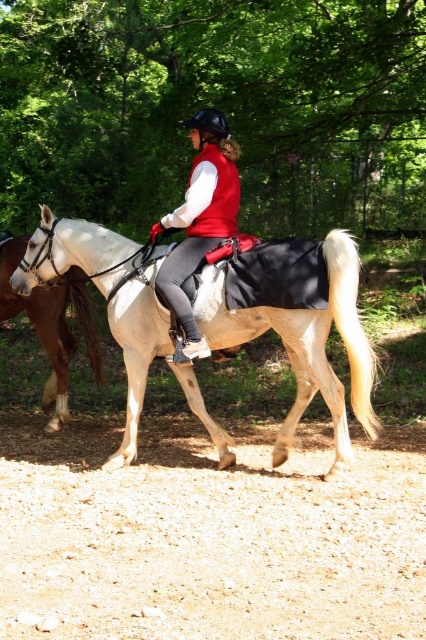
Which of these two, light beige fabric horse at center or brown glossy horse at left, stands taller?

brown glossy horse at left

From the picture: Does light beige fabric horse at center have a greater width compared to brown glossy horse at left?

Indeed, light beige fabric horse at center has a greater width compared to brown glossy horse at left.

Does point (368, 372) lie behind point (89, 348)?

That is False.

Identify the location of light beige fabric horse at center. This screenshot has height=640, width=426. (307, 346).

The height and width of the screenshot is (640, 426). In order to click on light beige fabric horse at center in this screenshot , I will do `click(307, 346)`.

Between light beige fabric horse at center and matte red vest at center, which one appears on the left side from the viewer's perspective?

Positioned to the left is matte red vest at center.

Between point (43, 241) and point (201, 120), which one is positioned in front?

Positioned in front is point (201, 120).

Image resolution: width=426 pixels, height=640 pixels. Identify the location of light beige fabric horse at center. (307, 346).

Does green leafy tree at upper center have a lesser width compared to light beige fabric horse at center?

No, green leafy tree at upper center is not thinner than light beige fabric horse at center.

Is point (236, 19) more distant than point (112, 465)?

Yes, it is behind point (112, 465).

Describe the element at coordinates (215, 106) in the screenshot. I see `green leafy tree at upper center` at that location.

Locate an element on the screen. green leafy tree at upper center is located at coordinates (215, 106).